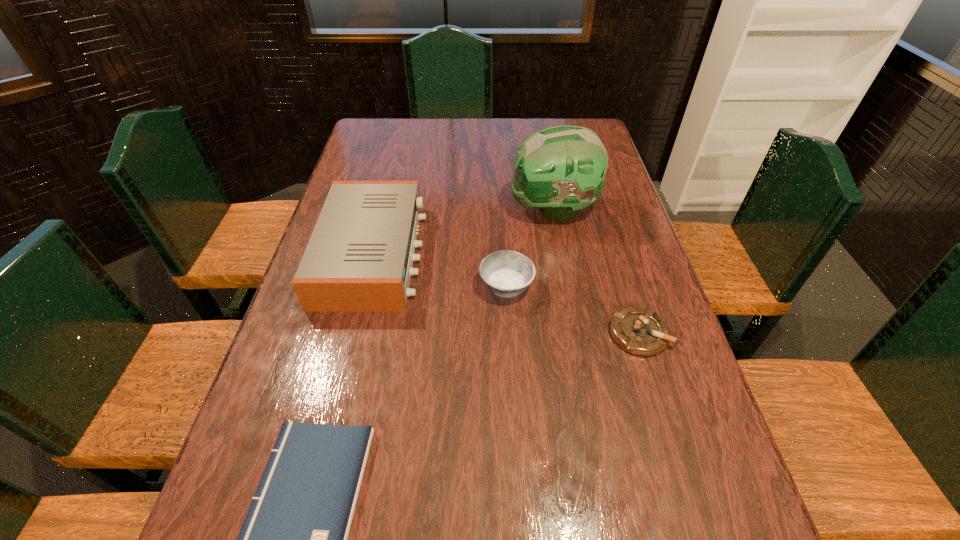
This screenshot has width=960, height=540. Find the location of `free space located 0.250m on the back of the third tallest object`. free space located 0.250m on the back of the third tallest object is located at coordinates (502, 211).

Identify the location of free region located 0.130m on the front of the fourth tallest object. (663, 412).

Identify the location of object at the left edge. The height and width of the screenshot is (540, 960). (360, 255).

Where is `football helmet situated at the right edge`? This screenshot has height=540, width=960. football helmet situated at the right edge is located at coordinates (560, 170).

I want to click on ashtray that is at the right edge, so click(x=637, y=330).

Locate an element on the screen. vacant space at the far edge of the desktop is located at coordinates (454, 133).

The width and height of the screenshot is (960, 540). In the image, there is a desktop. Identify the location of blank space at the left edge. (300, 407).

In order to click on blank space at the right edge of the desktop in this screenshot , I will do `click(604, 228)`.

In the image, there is a desktop. Where is `blank space at the far right corner`? Image resolution: width=960 pixels, height=540 pixels. blank space at the far right corner is located at coordinates (557, 120).

The width and height of the screenshot is (960, 540). Identify the location of free space between the shorter ashtray and the taller ashtray. (572, 310).